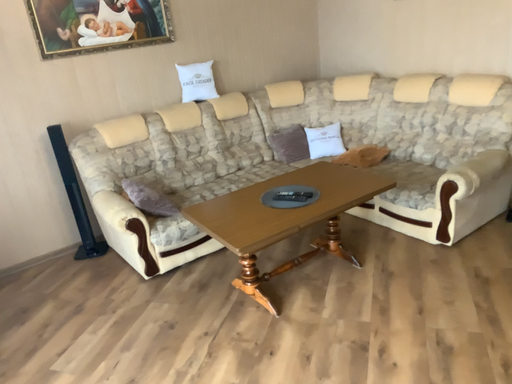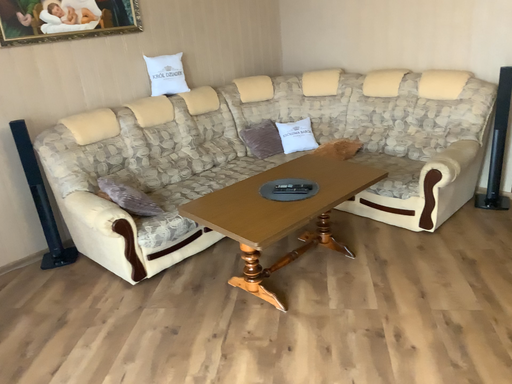
Question: How did the camera likely rotate when shooting the video?

Choices:
 (A) rotated left
 (B) rotated right

Answer: (B)